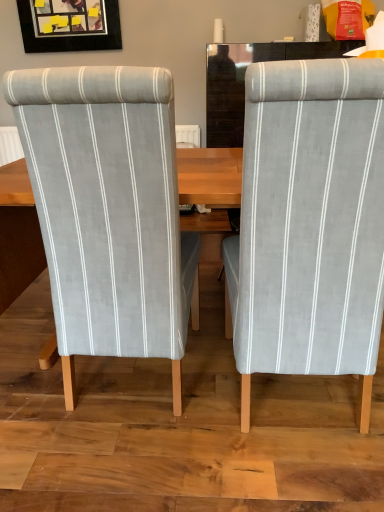
Question: Looking at the image, does light gray fabric chair at left, the first chair in the left-to-right sequence, seem bigger or smaller compared to matte black picture frame at upper left?

Choices:
 (A) small
 (B) big

Answer: (B)

Question: Is light gray fabric chair at left, the 2th chair positioned from the right, inside or outside of matte black picture frame at upper left?

Choices:
 (A) outside
 (B) inside

Answer: (A)

Question: Based on their relative distances, which object is farther from the light gray fabric chair at right, which is the second chair in left-to-right order?

Choices:
 (A) light gray fabric chair at left, the first chair in the left-to-right sequence
 (B) matte black picture frame at upper left

Answer: (B)

Question: Based on their relative distances, which object is farther from the matte black picture frame at upper left?

Choices:
 (A) light gray fabric chair at right, acting as the 1th chair starting from the right
 (B) light gray fabric chair at left, the first chair in the left-to-right sequence

Answer: (A)